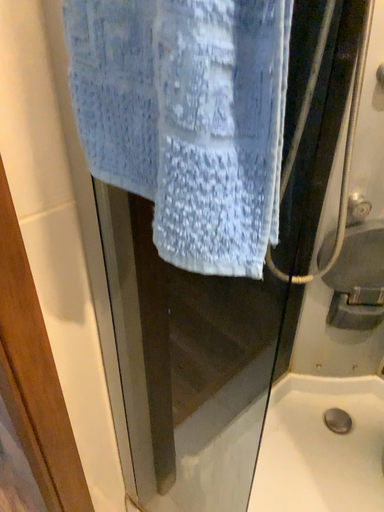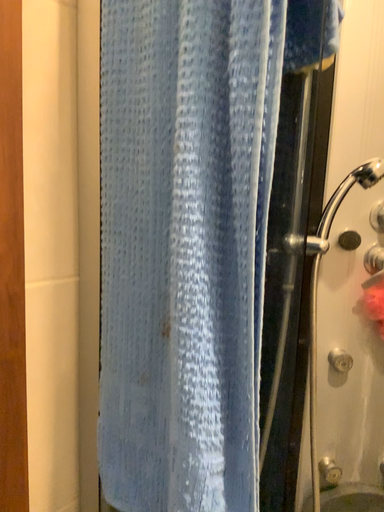
Question: Which way did the camera rotate in the video?

Choices:
 (A) rotated upward
 (B) rotated downward

Answer: (A)